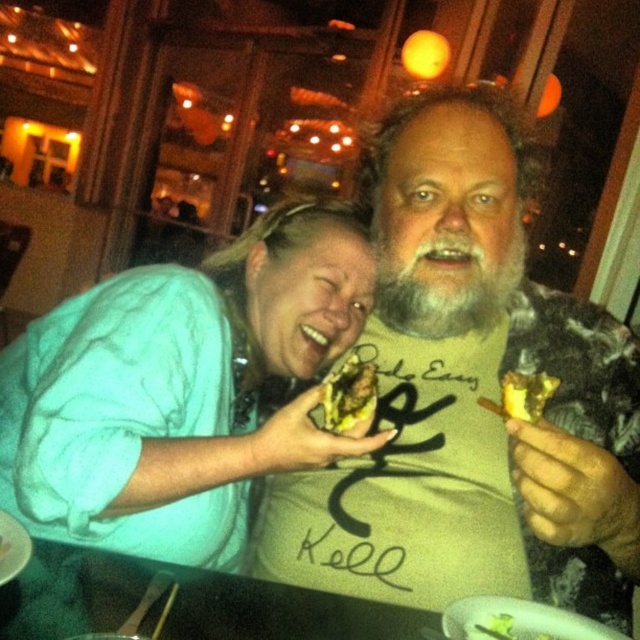
Who is more distant from viewer, (248,250) or (500,401)?

Positioned behind is point (248,250).

Who is shorter, light blue fabric shirt at upper left or brown crumbly bread at right?

With less height is brown crumbly bread at right.

Which is behind, point (16, 448) or point (552, 381)?

The point (16, 448) is more distant.

Identify the location of light blue fabric shirt at upper left. 180,388.

Can you confirm if brown crumbly bread at right is positioned to the left of brown crispy bread at center?

Incorrect, brown crumbly bread at right is not on the left side of brown crispy bread at center.

Who is higher up, brown crumbly bread at right or brown crispy bread at center?

Positioned higher is brown crumbly bread at right.

Is point (545, 394) closer to camera compared to point (4, 547)?

That is False.

Identify the location of brown crumbly bread at right. This screenshot has width=640, height=640. (525, 394).

Describe the element at coordinates (470, 396) in the screenshot. I see `beige soft shirt at center` at that location.

Which is more to the left, beige soft shirt at center or brown crispy bread at center?

brown crispy bread at center is more to the left.

Where is `beige soft shirt at center`? The width and height of the screenshot is (640, 640). beige soft shirt at center is located at coordinates (470, 396).

You are a GUI agent. You are given a task and a screenshot of the screen. Output one action in this format:
    pyautogui.click(x=<x>, y=<y>)
    Task: Click on the beige soft shirt at center
    The image size is (640, 640).
    Given the screenshot: What is the action you would take?
    pyautogui.click(x=470, y=396)